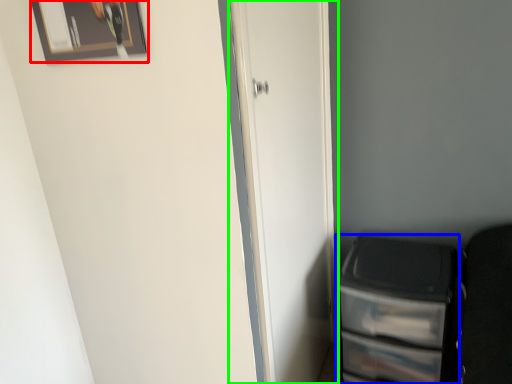
Question: Estimate the real-world distances between objects in this image. Which object is closer to picture frame (highlighted by a red box), file cabinet (highlighted by a blue box) or door (highlighted by a green box)?

Choices:
 (A) file cabinet
 (B) door

Answer: (B)